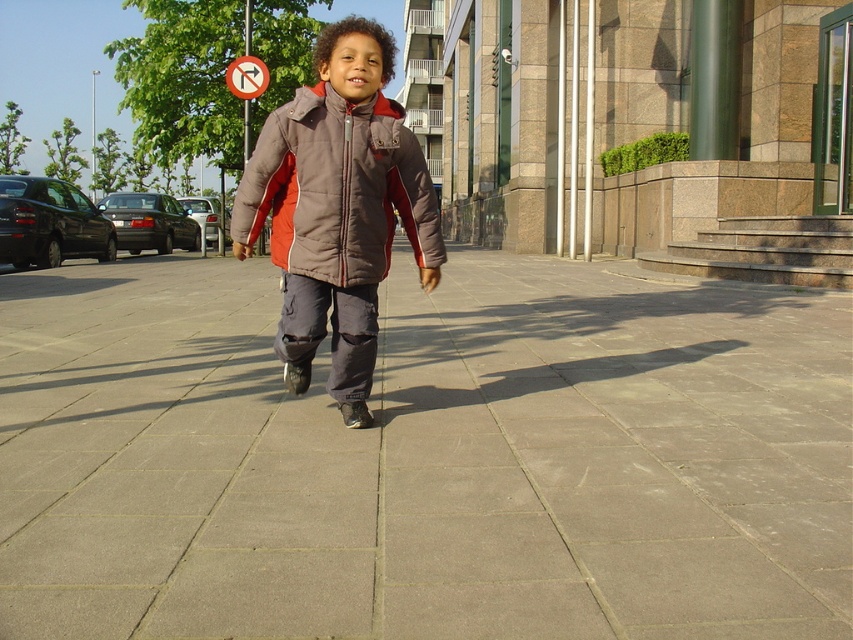
Is gray concrete pavement at center positioned at the back of brown puffy jacket at center?

No, it is in front of brown puffy jacket at center.

Can you confirm if gray concrete pavement at center is smaller than brown puffy jacket at center?

Yes, gray concrete pavement at center is smaller than brown puffy jacket at center.

You are a GUI agent. You are given a task and a screenshot of the screen. Output one action in this format:
    pyautogui.click(x=<x>, y=<y>)
    Task: Click on the gray concrete pavement at center
    The image size is (853, 640).
    Given the screenshot: What is the action you would take?
    pyautogui.click(x=422, y=460)